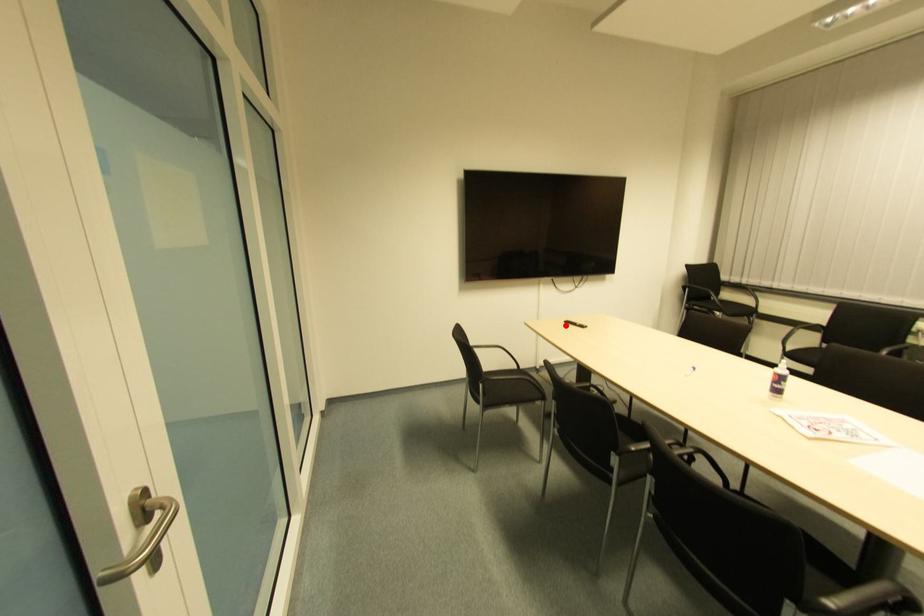
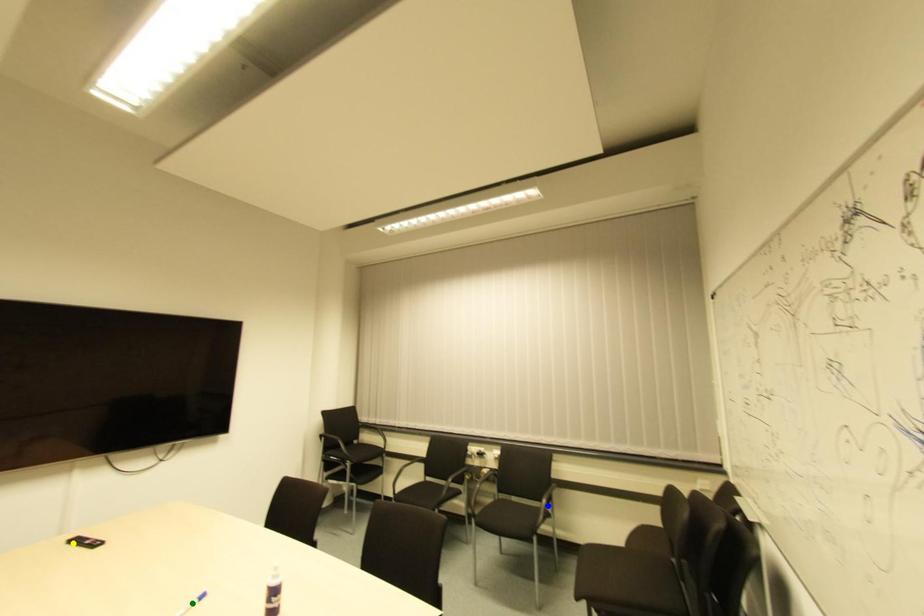
Question: I am providing you with two images of the same scene from different viewpoints. A red point is marked on the first image. You are given multiple points on the second image. Can you choose the point in image 2 that corresponds to the point in image 1?

Choices:
 (A) green point
 (B) blue point
 (C) yellow point

Answer: (C)